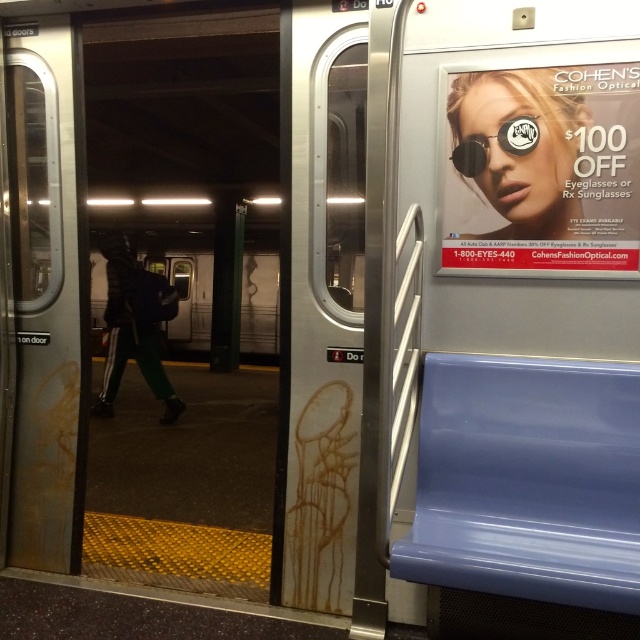
You are standing on the subway platform and want to board the train. You notice a person wearing green fabric pants at left. Where exactly are they located relative to the subway car doors?

The green fabric pants at left are located at point (134, 326) relative to the subway car doors.

Looking at this image, you are standing on the subway platform and see two points marked on the subway car doors. The first point is labeled as point (220, 449) and the second is point (502, 134). From your perspective on the platform, which point is closer to you?

Point (502, 134) is closer to you because it is in front of point (220, 449) according to their spatial arrangement.

You are a passenger standing at the subway car door. You notice the green fabric pants at left and the sunglasses at upper right in the reflection of the door. Which object appears taller in the reflection?

The green fabric pants at left appears much taller than the sunglasses at upper right in the reflection of the subway car door.